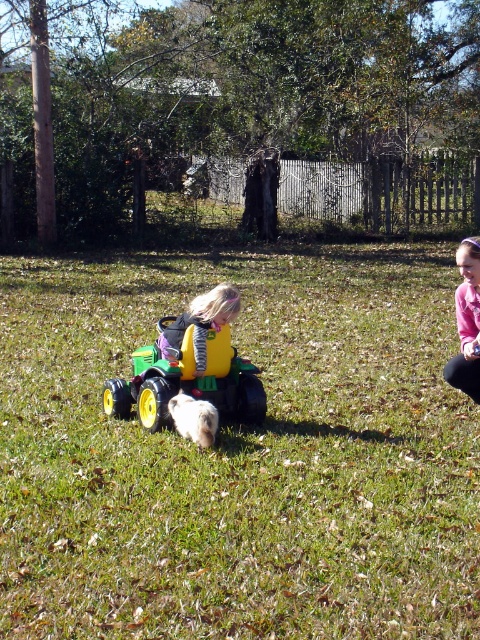
Question: Can you confirm if green plastic tractor at center is positioned below pink fleece jacket at right?

Choices:
 (A) no
 (B) yes

Answer: (B)

Question: Does green grass at center have a lesser width compared to matte yellow toy at center?

Choices:
 (A) no
 (B) yes

Answer: (A)

Question: Which of the following is the farthest from the observer?

Choices:
 (A) (201, 316)
 (B) (471, 337)

Answer: (B)

Question: Which point is farther from the camera taking this photo?

Choices:
 (A) (215, 317)
 (B) (456, 260)
 (C) (41, 266)

Answer: (C)

Question: From the image, what is the correct spatial relationship of green grass at center in relation to green plastic tractor at center?

Choices:
 (A) above
 (B) below

Answer: (B)

Question: Which object is closer to the camera taking this photo?

Choices:
 (A) matte yellow toy at center
 (B) green plastic tractor at center
 (C) pink fleece jacket at right

Answer: (B)